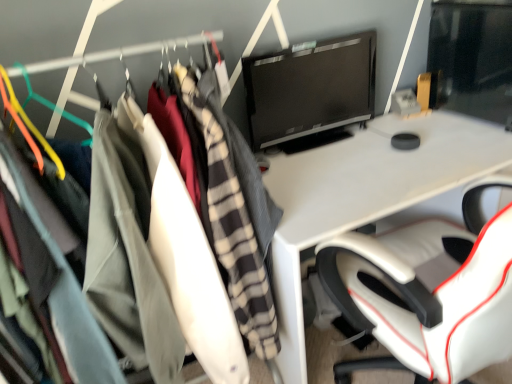
You are a GUI agent. You are given a task and a screenshot of the screen. Output one action in this format:
    pyautogui.click(x=<x>, y=<y>)
    Task: Click on the vacant space underneath black glossy monitor at upper right (from a real-world perspective)
    This screenshot has height=384, width=512.
    Given the screenshot: What is the action you would take?
    pyautogui.click(x=323, y=144)